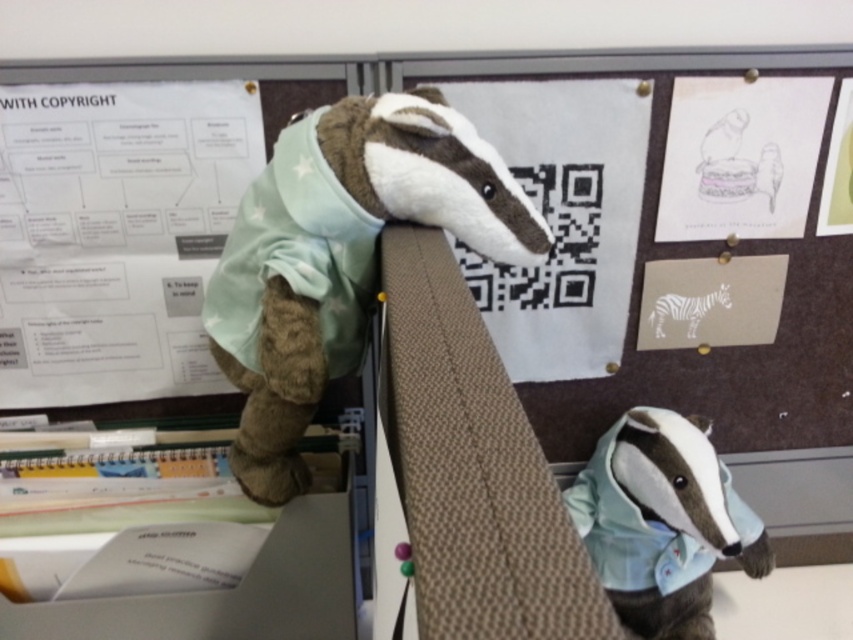
You are an office worker organizing the corkboard. You notice the white paper at upper left and the white paper at upper right. Which one is closer to you?

The white paper at upper left is closer to you because it is in front of the white paper at upper right.